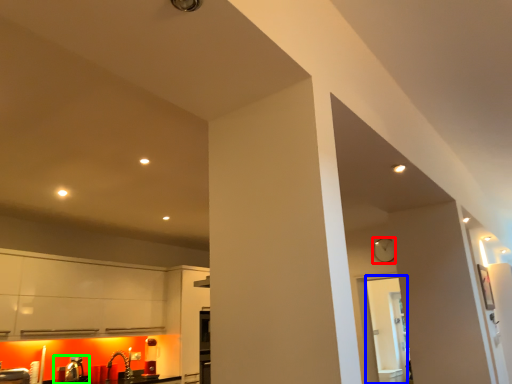
Question: Which object is the farthest from clock (highlighted by a red box)? Choose among these: glass door (highlighted by a blue box) or sink (highlighted by a green box).

Choices:
 (A) glass door
 (B) sink

Answer: (B)